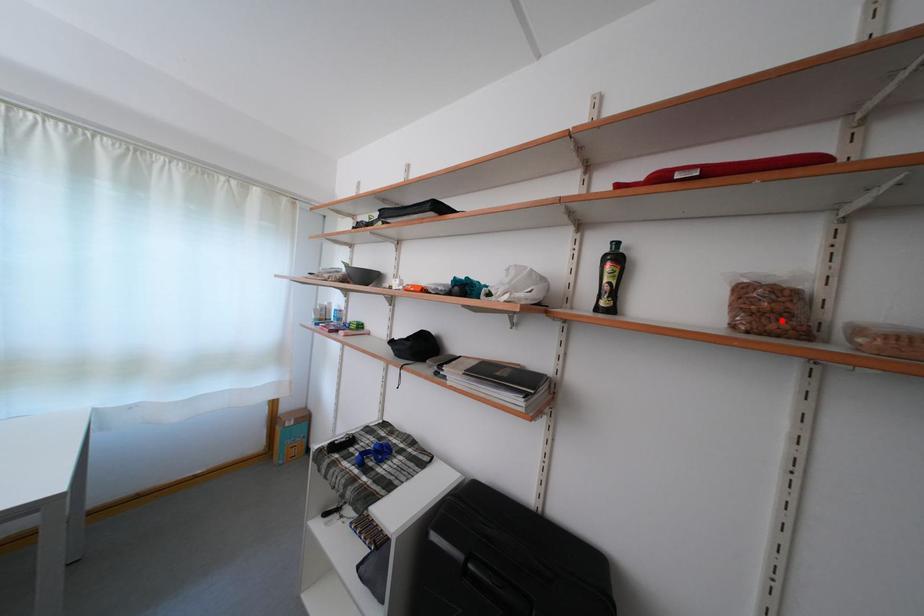
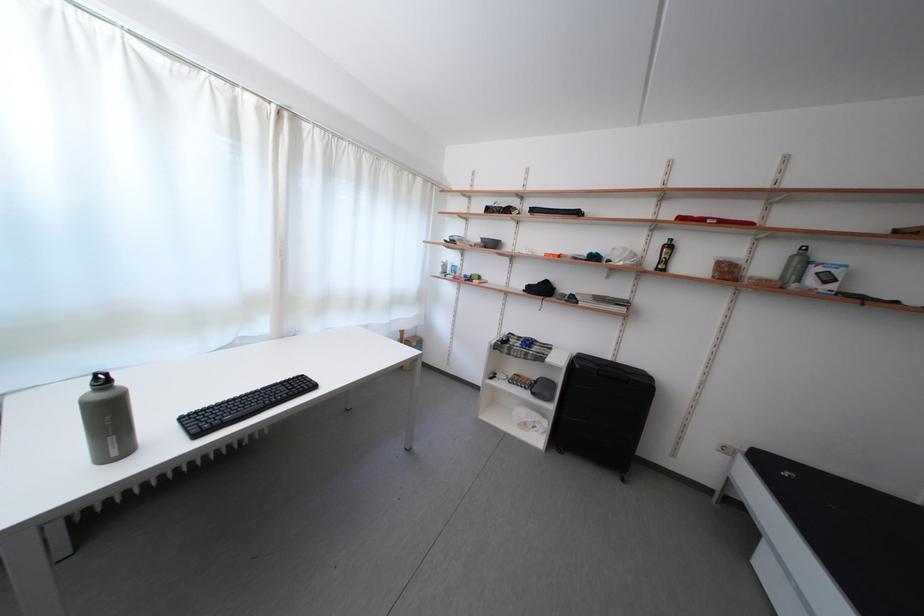
In the second image, find the point that corresponds to the highlighted location in the first image.

(736, 278)